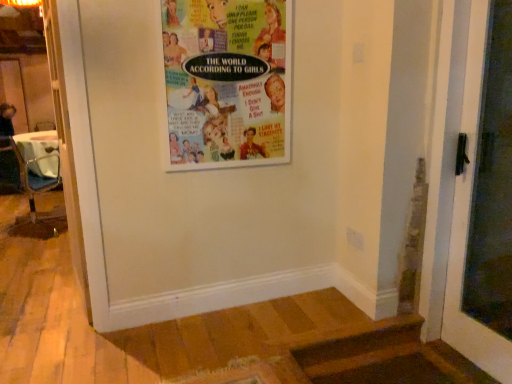
This screenshot has height=384, width=512. What are the coordinates of `metallic silver chair at left` in the screenshot? It's located at (33, 180).

Identify the location of white glossy door at right. Image resolution: width=512 pixels, height=384 pixels. (467, 224).

Is the surface of metallic silver chair at left in direct contact with multicolored paper poster at upper center?

No, metallic silver chair at left is not touching multicolored paper poster at upper center.

From a real-world perspective, is metallic silver chair at left below multicolored paper poster at upper center?

Correct, in the physical world, metallic silver chair at left is lower than multicolored paper poster at upper center.

Can you tell me how much metallic silver chair at left and multicolored paper poster at upper center differ in facing direction?

metallic silver chair at left and multicolored paper poster at upper center are facing 141 degrees away from each other.

Can you confirm if metallic silver chair at left is shorter than multicolored paper poster at upper center?

No.

Does white glossy door at right have a smaller size compared to multicolored paper poster at upper center?

Actually, white glossy door at right might be larger than multicolored paper poster at upper center.

Can you tell me how much white glossy door at right and multicolored paper poster at upper center differ in facing direction?

white glossy door at right and multicolored paper poster at upper center are facing 90.3 degrees away from each other.

Considering the positions of objects white glossy door at right and multicolored paper poster at upper center in the image provided, who is more to the right, white glossy door at right or multicolored paper poster at upper center?

white glossy door at right.

Is multicolored paper poster at upper center turned away from white glossy door at right?

multicolored paper poster at upper center is not turned away from white glossy door at right.

Who is taller, multicolored paper poster at upper center or white glossy door at right?

With more height is white glossy door at right.

Considering the relative sizes of multicolored paper poster at upper center and white glossy door at right in the image provided, is multicolored paper poster at upper center thinner than white glossy door at right?

Yes.

Locate an element on the screen. door on the right of multicolored paper poster at upper center is located at coordinates (467, 224).

Which point is more forward, (500, 345) or (56, 143)?

The point (500, 345) is more forward.

From a real-world perspective, who is located higher, white glossy door at right or metallic silver chair at left?

In real-world perspective, white glossy door at right is above.

Looking at their sizes, would you say white glossy door at right is wider or thinner than metallic silver chair at left?

Clearly, white glossy door at right has less width compared to metallic silver chair at left.

Is white glossy door at right closer to camera compared to metallic silver chair at left?

Yes, white glossy door at right is in front of metallic silver chair at left.

Is metallic silver chair at left not inside white glossy door at right?

Yes, metallic silver chair at left is located beyond the bounds of white glossy door at right.

What's the angular difference between metallic silver chair at left and white glossy door at right's facing directions?

129 degrees separate the facing orientations of metallic silver chair at left and white glossy door at right.

Can you confirm if metallic silver chair at left is taller than white glossy door at right?

No, metallic silver chair at left is not taller than white glossy door at right.

Considering the relative positions of multicolored paper poster at upper center and metallic silver chair at left in the image provided, is multicolored paper poster at upper center behind metallic silver chair at left?

No.

Is multicolored paper poster at upper center wider or thinner than metallic silver chair at left?

Clearly, multicolored paper poster at upper center has less width compared to metallic silver chair at left.

Is multicolored paper poster at upper center inside or outside of metallic silver chair at left?

multicolored paper poster at upper center is not inside metallic silver chair at left, it's outside.

Considering the positions of objects multicolored paper poster at upper center and metallic silver chair at left in the image provided, who is more to the right, multicolored paper poster at upper center or metallic silver chair at left?

multicolored paper poster at upper center is more to the right.

The image size is (512, 384). Find the location of `chair that is below the multicolored paper poster at upper center (from the image's perspective)`. chair that is below the multicolored paper poster at upper center (from the image's perspective) is located at coordinates (33, 180).

Find the location of a particular element. This screenshot has width=512, height=384. door located in front of the multicolored paper poster at upper center is located at coordinates (467, 224).

Which object lies nearer to the anchor point metallic silver chair at left, multicolored paper poster at upper center or white glossy door at right?

multicolored paper poster at upper center.

From the image, which object appears to be farther from multicolored paper poster at upper center, white glossy door at right or metallic silver chair at left?

metallic silver chair at left is positioned further to the anchor multicolored paper poster at upper center.

Looking at the image, which one is located further to metallic silver chair at left, white glossy door at right or multicolored paper poster at upper center?

white glossy door at right.

In the scene shown: Based on their spatial positions, is metallic silver chair at left or multicolored paper poster at upper center further from white glossy door at right?

Based on the image, metallic silver chair at left appears to be further to white glossy door at right.

Estimate the real-world distances between objects in this image. Which object is further from white glossy door at right, multicolored paper poster at upper center or metallic silver chair at left?

metallic silver chair at left is positioned further to the anchor white glossy door at right.

Estimate the real-world distances between objects in this image. Which object is further from multicolored paper poster at upper center, metallic silver chair at left or white glossy door at right?

metallic silver chair at left lies further to multicolored paper poster at upper center than the other object.

This screenshot has height=384, width=512. In order to click on poster located between metallic silver chair at left and white glossy door at right in the left-right direction in this screenshot , I will do `click(227, 82)`.